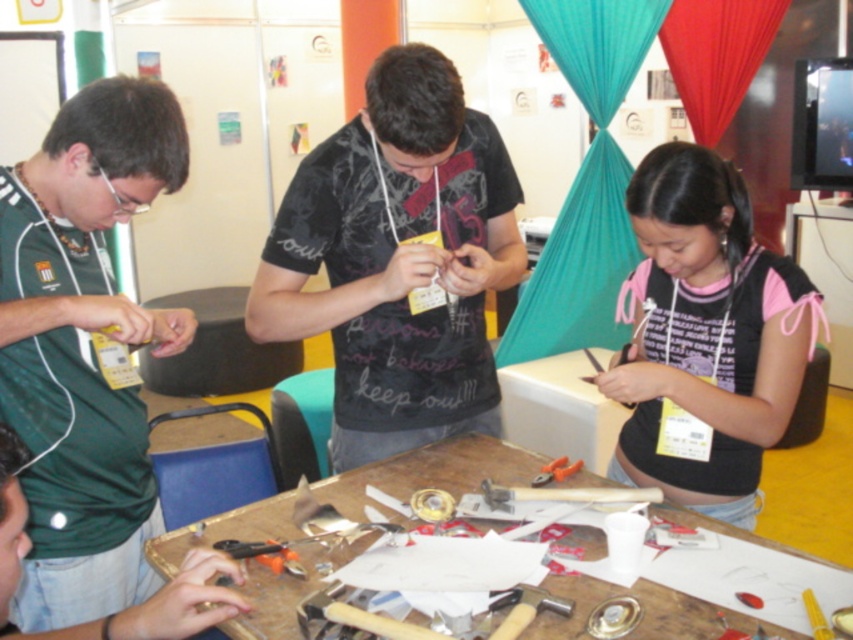
Is pink fabric at center closer to camera compared to wooden workbench at center?

No, it is behind wooden workbench at center.

Does pink fabric at center have a larger size compared to wooden workbench at center?

Incorrect, pink fabric at center is not larger than wooden workbench at center.

Between point (642, 202) and point (675, 604), which one is positioned in front?

Point (675, 604) is in front.

Locate an element on the screen. pink fabric at center is located at coordinates (706, 333).

Is green matte shirt at left further to camera compared to wooden workbench at center?

That is True.

Who is more distant from viewer, (56,332) or (289,636)?

The point (56,332) is behind.

Measure the distance between point (125, 506) and camera.

They are 4.90 feet apart.

The image size is (853, 640). Identify the location of green matte shirt at left. (84, 348).

Between green matte shirt at left and wooden hammer at center, which one has more height?

green matte shirt at left is taller.

Does green matte shirt at left appear on the left side of wooden hammer at center?

Yes, green matte shirt at left is to the left of wooden hammer at center.

Does point (125, 216) lie in front of point (611, 497)?

Yes, point (125, 216) is closer to viewer.

In order to click on green matte shirt at left in this screenshot , I will do `click(84, 348)`.